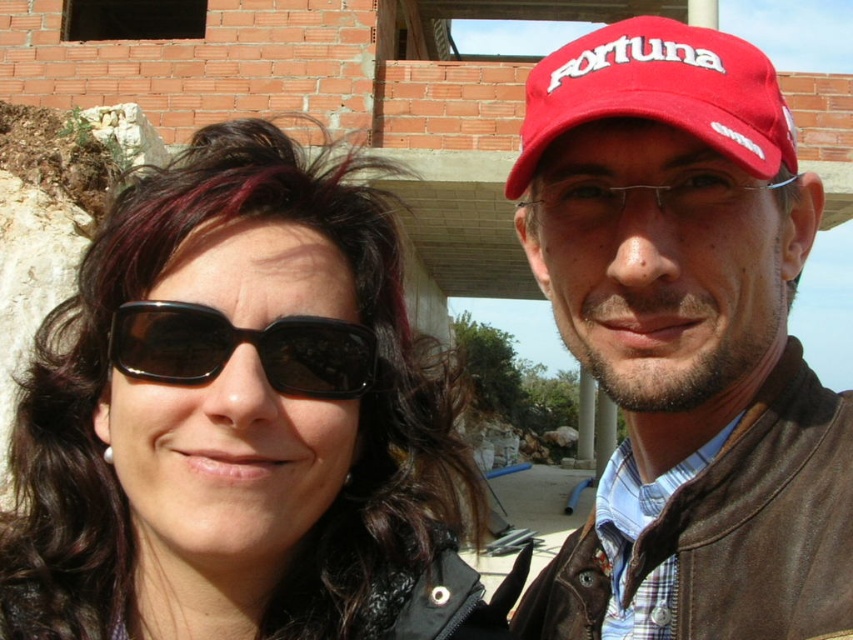
Question: Based on their relative distances, which object is farther from the black reflective sunglasses at center?

Choices:
 (A) black matte sunglasses at upper left
 (B) matte leather jacket at right
 (C) red fabric cap at upper right

Answer: (B)

Question: Considering the relative positions of black matte sunglasses at upper left and red fabric cap at upper right in the image provided, where is black matte sunglasses at upper left located with respect to red fabric cap at upper right?

Choices:
 (A) above
 (B) below

Answer: (B)

Question: Is matte leather jacket at right closer to camera compared to red fabric cap at upper right?

Choices:
 (A) no
 (B) yes

Answer: (B)

Question: Where is red fabric cap at upper right located in relation to black reflective sunglasses at center in the image?

Choices:
 (A) right
 (B) left

Answer: (A)

Question: Which of the following is the farthest from the observer?

Choices:
 (A) matte leather jacket at right
 (B) black reflective sunglasses at center
 (C) black matte sunglasses at upper left

Answer: (C)

Question: Which object is farther from the camera taking this photo?

Choices:
 (A) black matte sunglasses at upper left
 (B) matte leather jacket at right
 (C) black reflective sunglasses at center

Answer: (A)